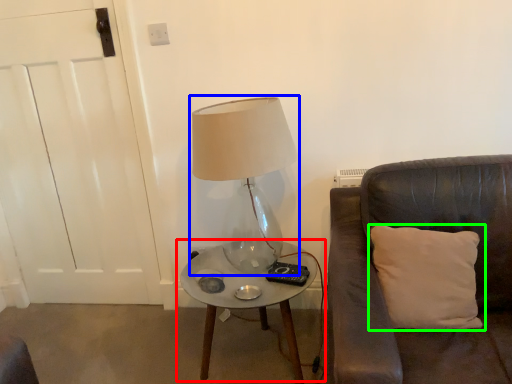
Question: Estimate the real-world distances between objects in this image. Which object is closer to table (highlighted by a red box), lamp (highlighted by a blue box) or pillow (highlighted by a green box)?

Choices:
 (A) lamp
 (B) pillow

Answer: (B)